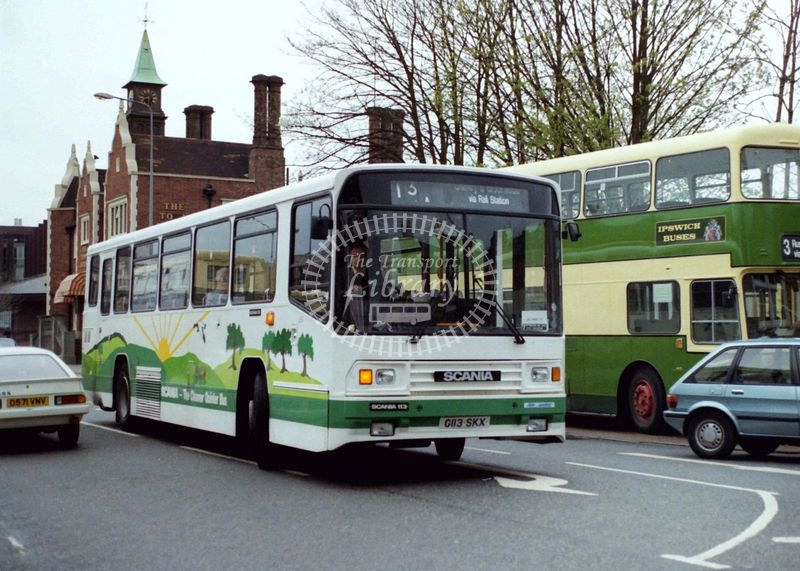
The height and width of the screenshot is (571, 800). In order to click on clock in this screenshot , I will do `click(150, 96)`.